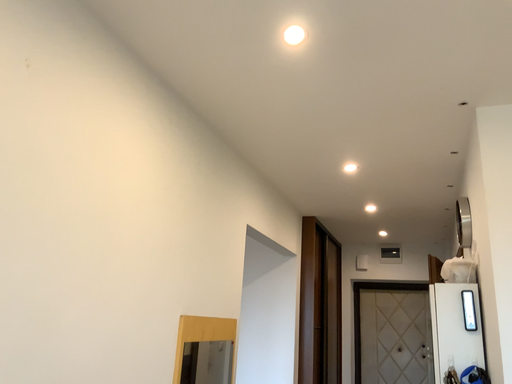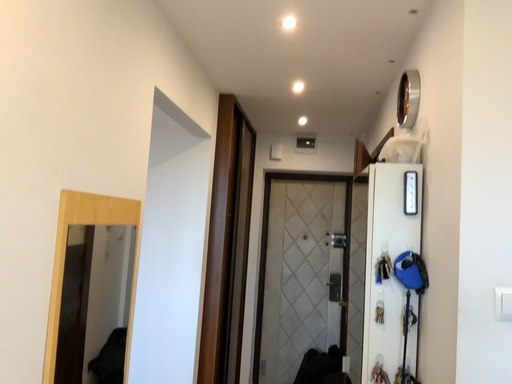
Question: Which way did the camera rotate in the video?

Choices:
 (A) rotated upward
 (B) rotated downward

Answer: (B)